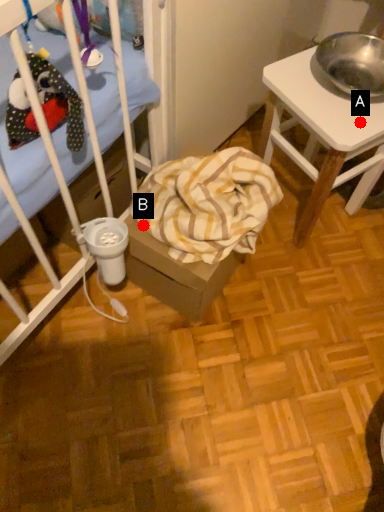
Question: Two points are circled on the image, labeled by A and B beside each circle. Which point appears farthest from the camera in this image?

Choices:
 (A) A is further
 (B) B is further

Answer: (B)